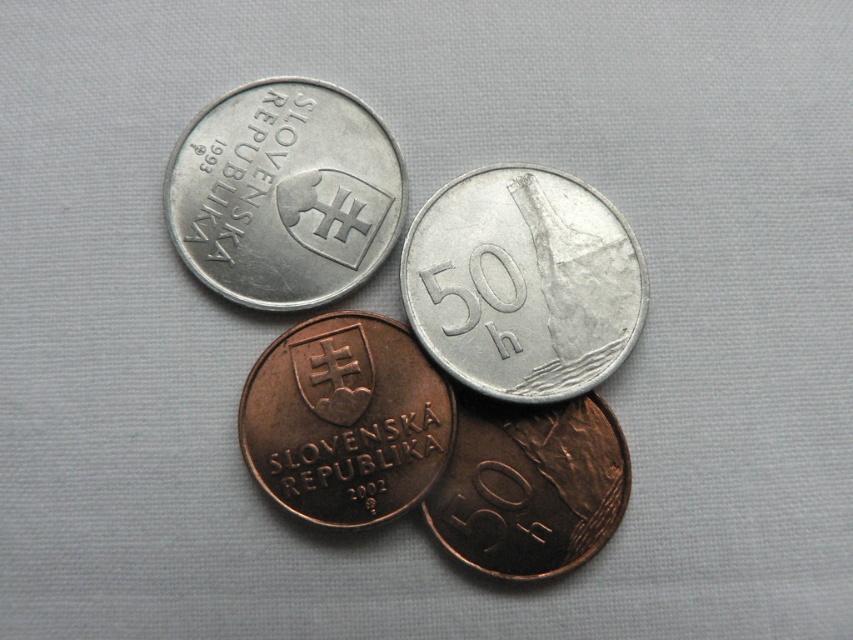
Question: Does silver metallic coin at upper left come behind brown copper coin at center?

Choices:
 (A) yes
 (B) no

Answer: (A)

Question: Which object is the farthest from the silver metallic coin at upper right?

Choices:
 (A) brown copper coin at center
 (B) bronze metallic coin at center
 (C) silver metallic coin at upper left

Answer: (C)

Question: Which object is positioned farthest from the silver metallic coin at upper left?

Choices:
 (A) brown copper coin at center
 (B) bronze metallic coin at center

Answer: (A)

Question: Among these objects, which one is farthest from the camera?

Choices:
 (A) silver metallic coin at upper right
 (B) silver metallic coin at upper left
 (C) brown copper coin at center

Answer: (B)

Question: Is silver metallic coin at upper left to the right of bronze metallic coin at center from the viewer's perspective?

Choices:
 (A) yes
 (B) no

Answer: (B)

Question: Is bronze metallic coin at center wider than brown copper coin at center?

Choices:
 (A) yes
 (B) no

Answer: (A)